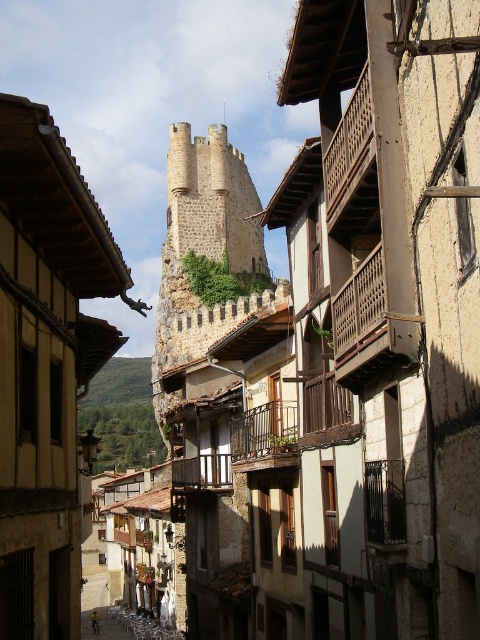
Question: Considering the real-world distances, which object is closest to the stone tower at center?

Choices:
 (A) wooden at upper center
 (B) brown wooden balcony at center

Answer: (B)

Question: Is stone tower at center to the left of brown wooden balcony at center from the viewer's perspective?

Choices:
 (A) no
 (B) yes

Answer: (B)

Question: Which point is farther to the camera?

Choices:
 (A) wooden at upper center
 (B) stone tower at center

Answer: (B)

Question: Does stone tower at center have a larger size compared to brown wooden balcony at center?

Choices:
 (A) no
 (B) yes

Answer: (B)

Question: Which object is farther from the camera taking this photo?

Choices:
 (A) wooden at upper center
 (B) brown wooden balcony at center
 (C) stone tower at center

Answer: (C)

Question: Can you confirm if wooden at upper center is positioned above brown wooden balcony at center?

Choices:
 (A) yes
 (B) no

Answer: (A)